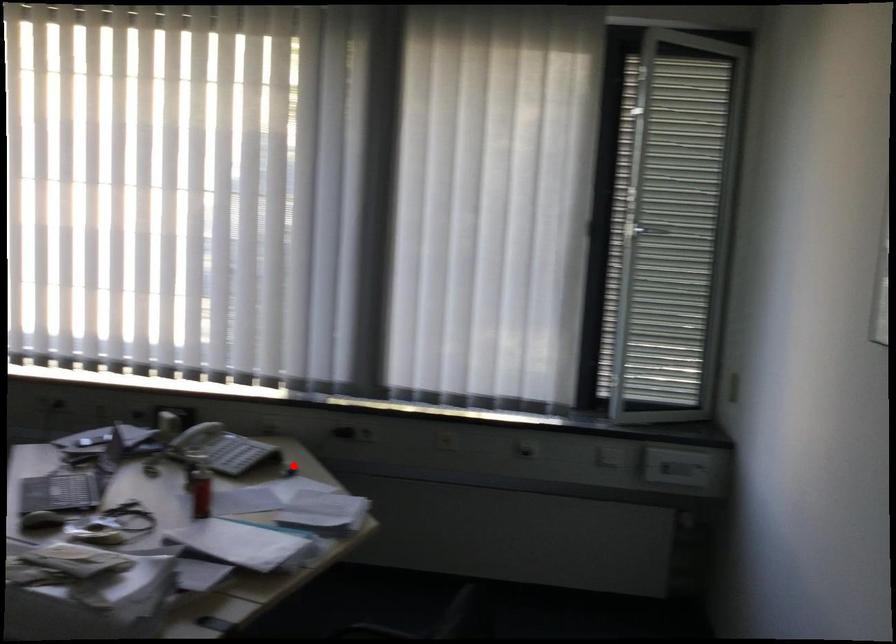
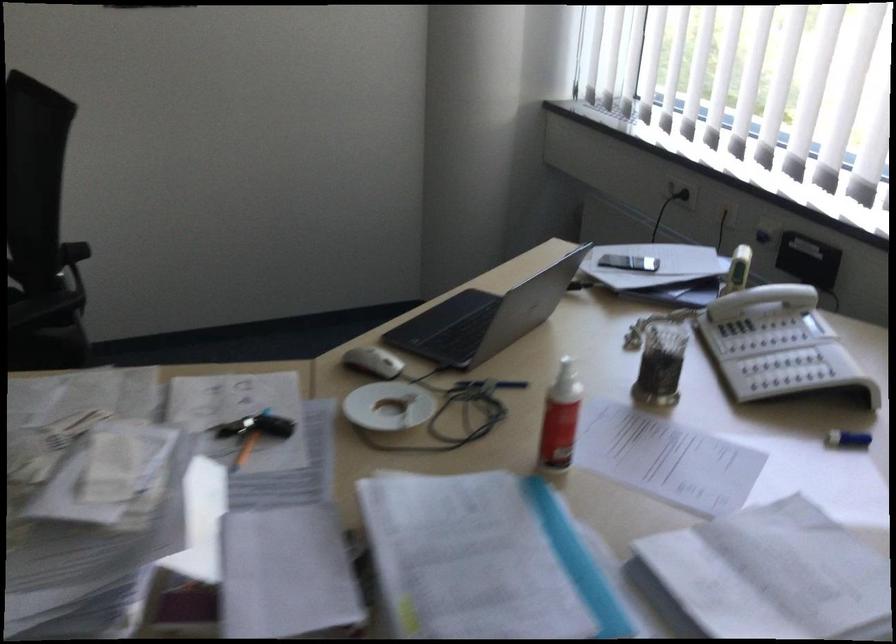
Question: I am providing you with two images of the same scene from different viewpoints. In image1, a red point is highlighted. Considering the same 3D point in image2, which of the following is correct?

Choices:
 (A) It is closer
 (B) It is farther

Answer: (A)